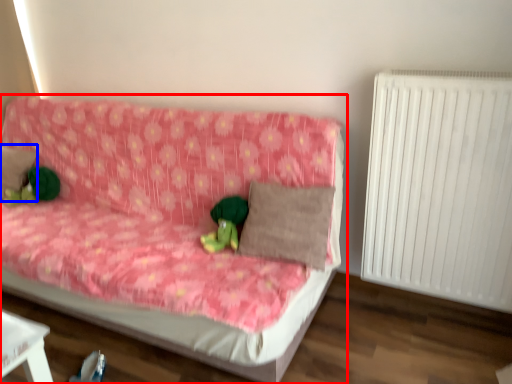
Question: Which object is closer to the camera taking this photo, studio couch (highlighted by a red box) or pillow (highlighted by a blue box)?

Choices:
 (A) studio couch
 (B) pillow

Answer: (A)